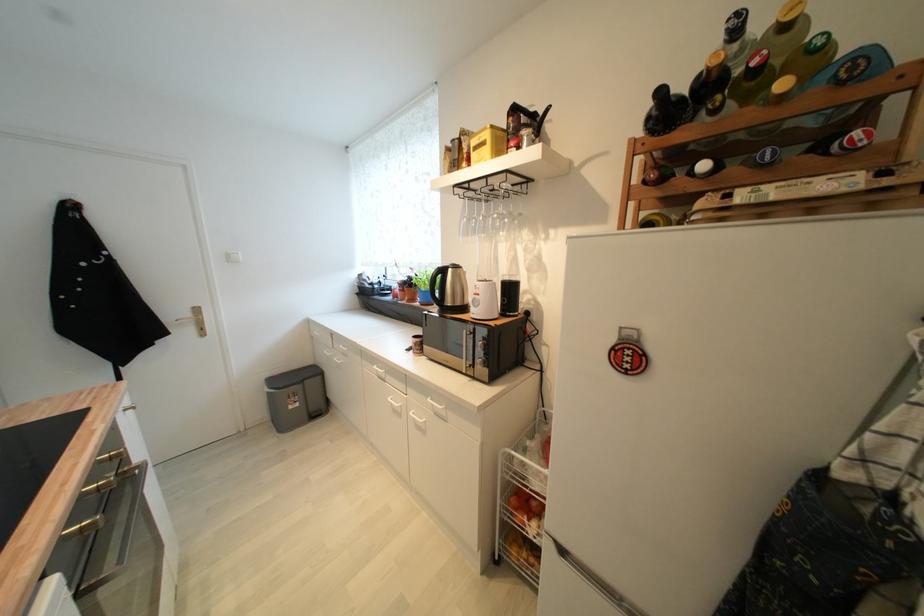
Where is `white blender dial`? white blender dial is located at coordinates (484, 293).